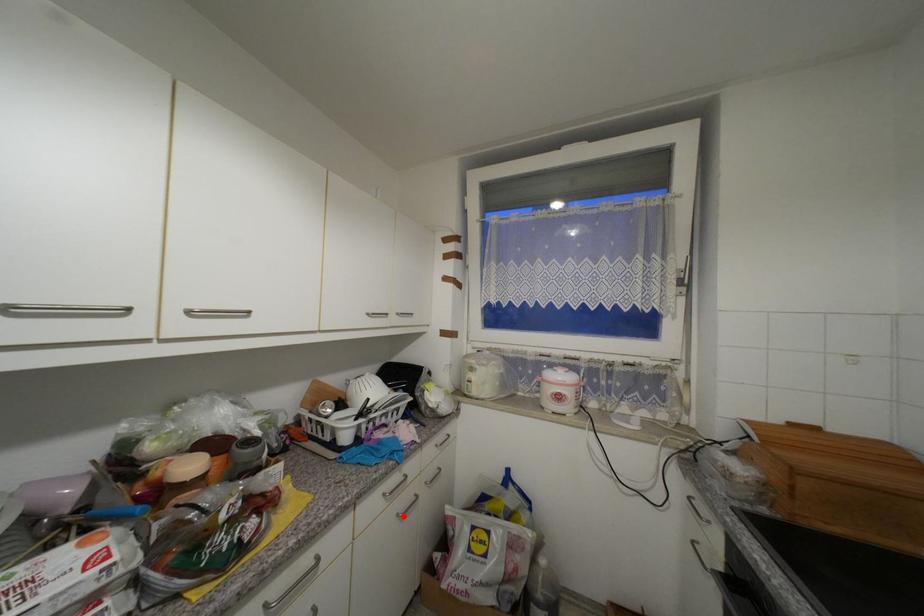
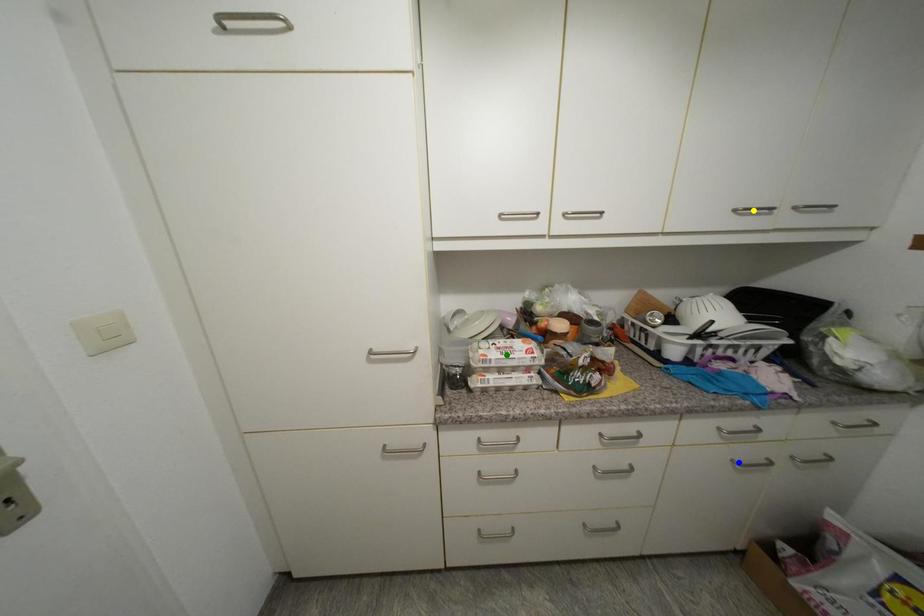
Question: I am providing you with two images of the same scene from different viewpoints. A red point is marked on the first image. You are given multiple points on the second image. Can you choose the point in image 2 that corresponds to the point in image 1?

Choices:
 (A) yellow point
 (B) blue point
 (C) green point

Answer: (B)